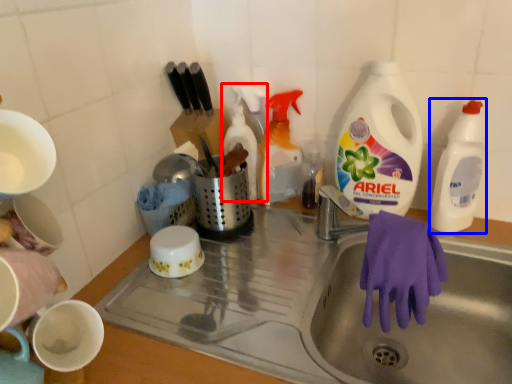
Question: Which of the following is the farthest to the observer, cleaning product (highlighted by a red box) or cleaning product (highlighted by a blue box)?

Choices:
 (A) cleaning product
 (B) cleaning product

Answer: (A)